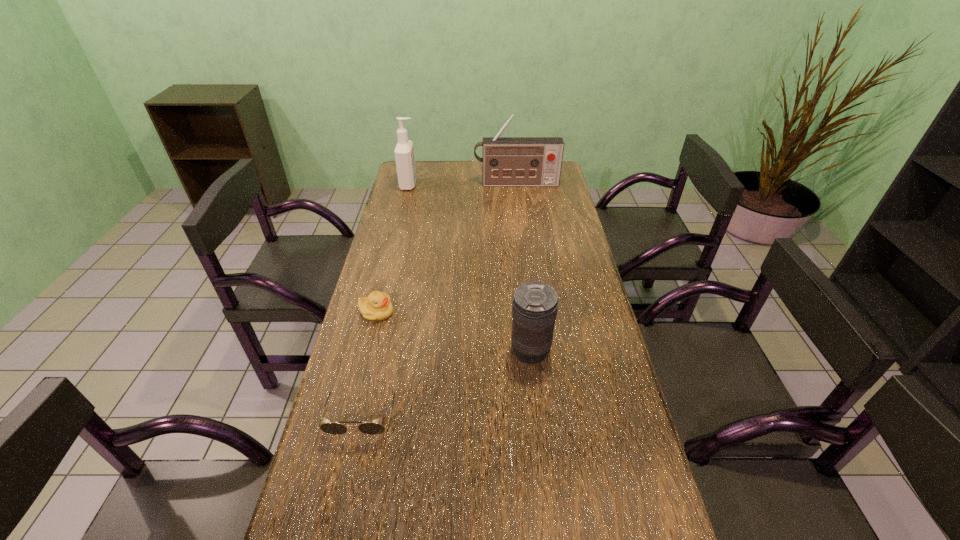
What are the coordinates of `blank area located on the side of the third shortest object where the control switches are located` in the screenshot? It's located at pyautogui.click(x=441, y=351).

The width and height of the screenshot is (960, 540). What are the coordinates of `free space located at the face of the third nearest object` in the screenshot? It's located at (513, 312).

You are a GUI agent. You are given a task and a screenshot of the screen. Output one action in this format:
    pyautogui.click(x=<x>, y=<y>)
    Task: Click on the vacant region located 0.140m on the front lenses of the sunglasses
    The height and width of the screenshot is (540, 960).
    Given the screenshot: What is the action you would take?
    pyautogui.click(x=343, y=504)

At what (x,y) coordinates should I click in order to perform the action: click on radio receiver at the far edge. Please return your answer as a coordinate pair (x, y). Image resolution: width=960 pixels, height=540 pixels. Looking at the image, I should click on (507, 161).

Identify the location of cleansing agent present at the far edge. Image resolution: width=960 pixels, height=540 pixels. (404, 152).

Find the location of a particular element. cleansing agent situated at the left edge is located at coordinates (404, 152).

The image size is (960, 540). I want to click on duckling present at the left edge, so (377, 306).

Image resolution: width=960 pixels, height=540 pixels. What are the coordinates of `sunglasses positioned at the left edge` in the screenshot? It's located at (332, 428).

Find the location of a particular element. The height and width of the screenshot is (540, 960). object present at the right edge is located at coordinates (507, 161).

In order to click on object present at the far left corner in this screenshot , I will do `click(404, 152)`.